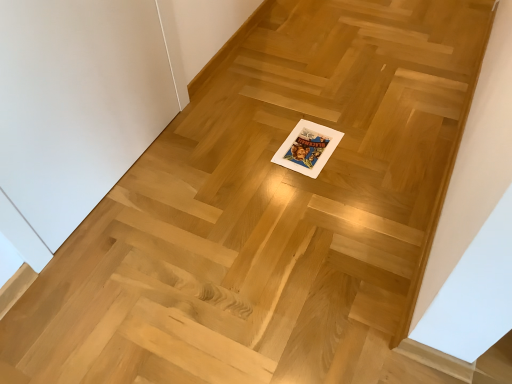
Find the location of `free spot in front of white paper at center`. free spot in front of white paper at center is located at coordinates (317, 190).